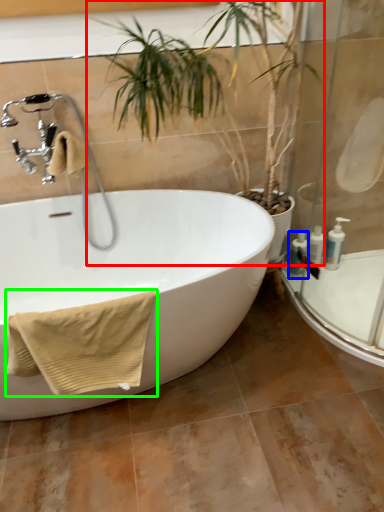
Question: Which object is positioned farthest from houseplant (highlighted by a red box)? Select from toiletry (highlighted by a blue box) and bath towel (highlighted by a green box).

Choices:
 (A) toiletry
 (B) bath towel

Answer: (B)